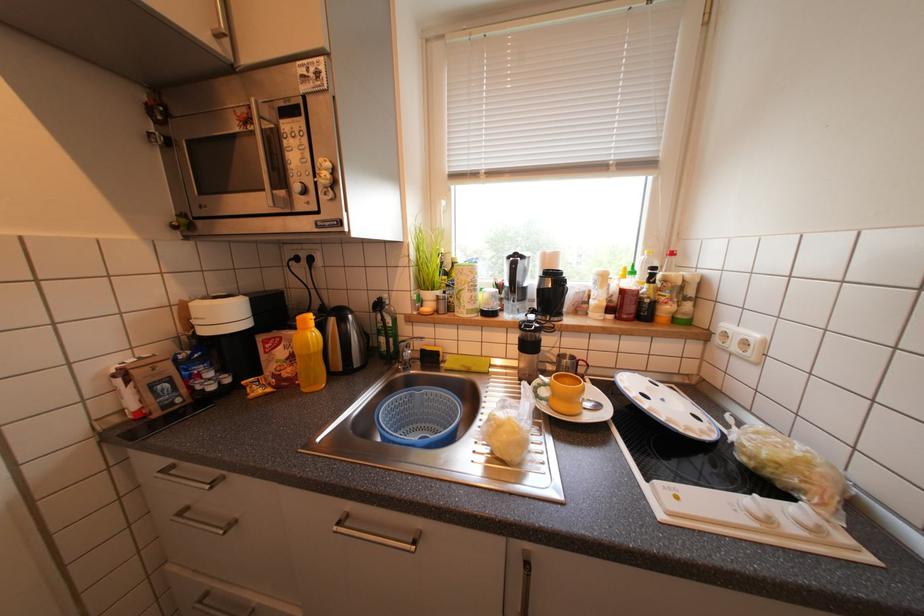
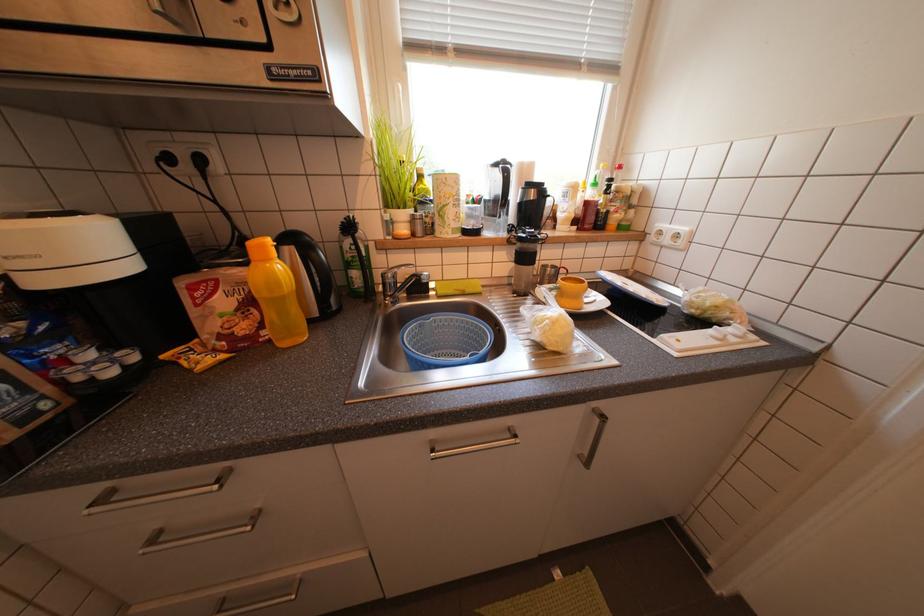
In a continuous first-person perspective shot, in which direction is the camera moving?

The movement direction of the cameraman is left, forward.